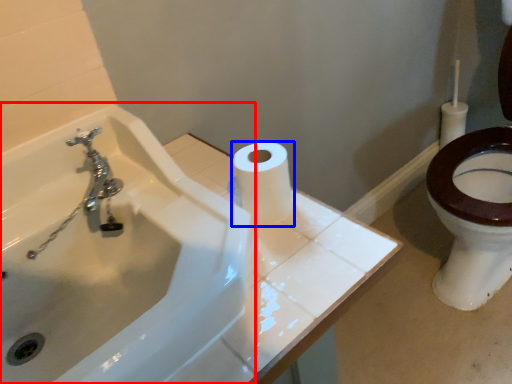
Question: Among these objects, which one is farthest to the camera, sink (highlighted by a red box) or toilet paper (highlighted by a blue box)?

Choices:
 (A) sink
 (B) toilet paper

Answer: (B)